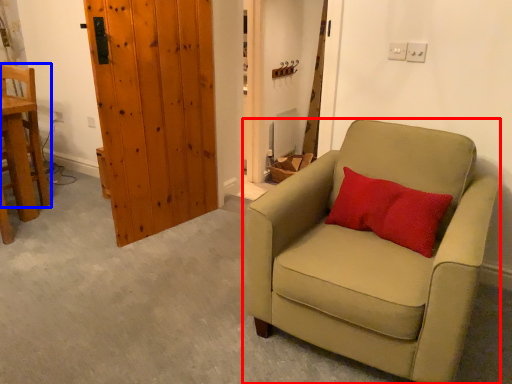
Question: Which point is further to the camera, chair (highlighted by a red box) or chair (highlighted by a blue box)?

Choices:
 (A) chair
 (B) chair

Answer: (B)